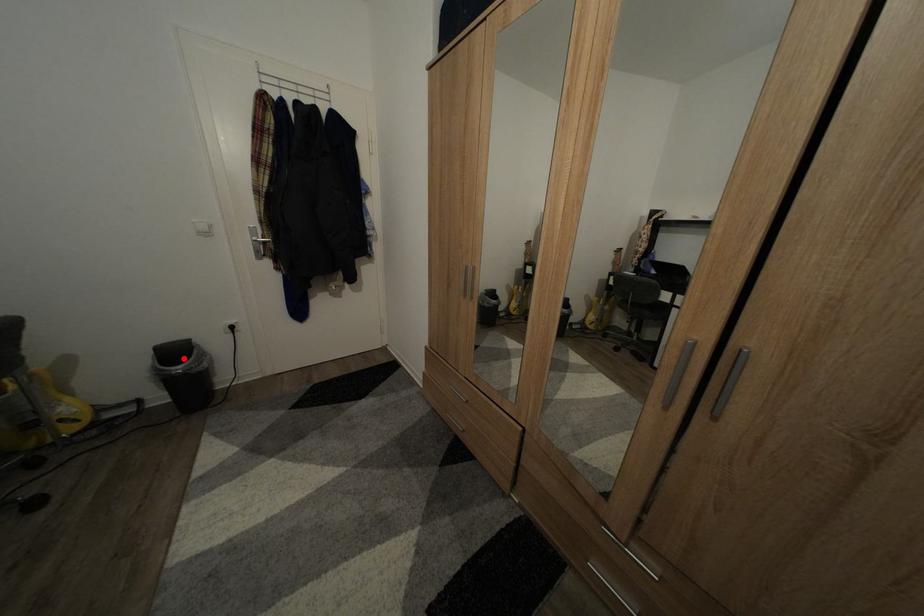
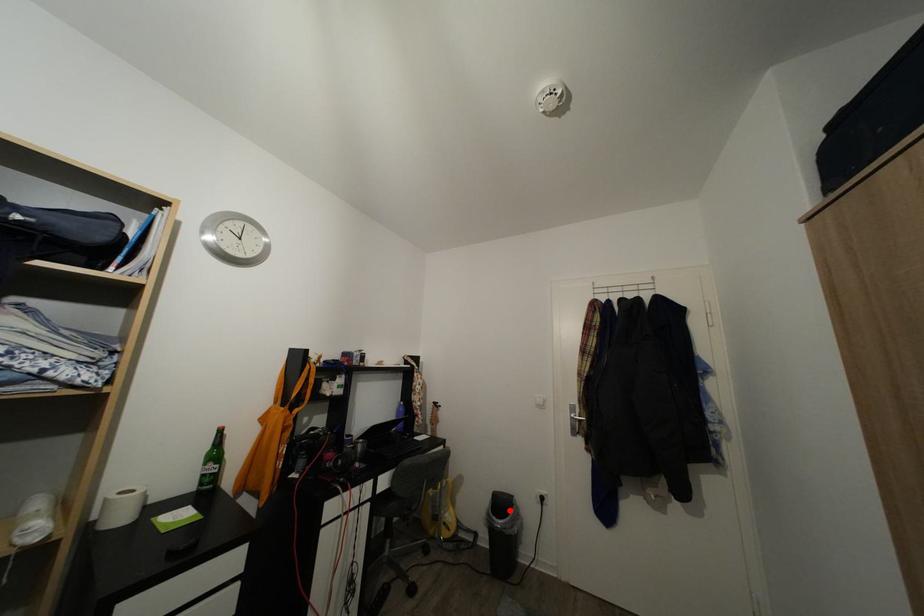
I am providing you with two images of the same scene from different viewpoints. A red point is marked on the first image and another point is marked on the second image. Is the marked point in image1 the same physical position as the marked point in image2?

Yes